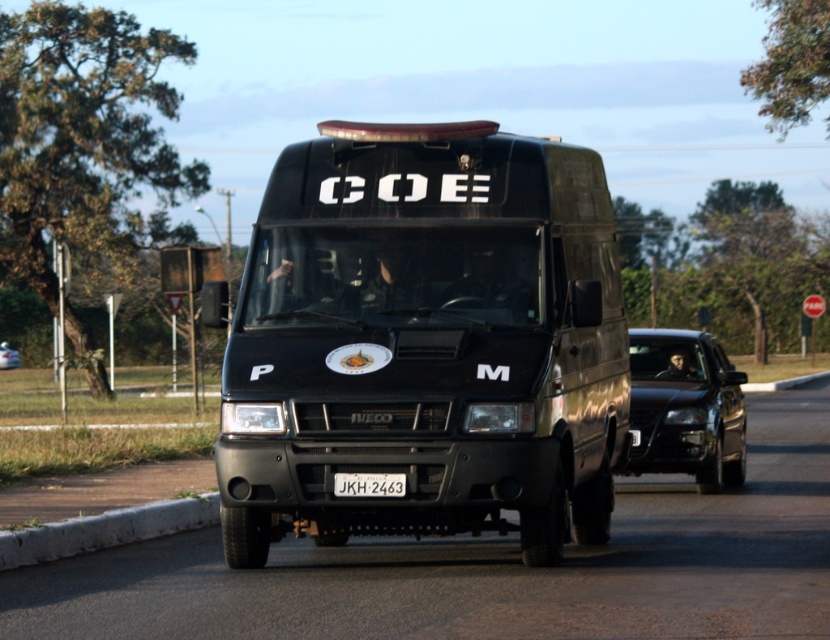
Question: Which point appears farthest from the camera in this image?

Choices:
 (A) (691, 468)
 (B) (616, 381)

Answer: (A)

Question: Among these objects, which one is farthest from the camera?

Choices:
 (A) black matte van at center
 (B) black glossy sedan at center

Answer: (B)

Question: Is black glossy sedan at center above white plastic license plate at center?

Choices:
 (A) yes
 (B) no

Answer: (A)

Question: Which object appears closest to the camera in this image?

Choices:
 (A) white plastic license plate at center
 (B) black glossy sedan at center

Answer: (A)

Question: Does black matte van at center lie behind white plastic license plate at center?

Choices:
 (A) no
 (B) yes

Answer: (A)

Question: In this image, where is black glossy sedan at center located relative to white plastic license plate at center?

Choices:
 (A) above
 (B) below

Answer: (A)